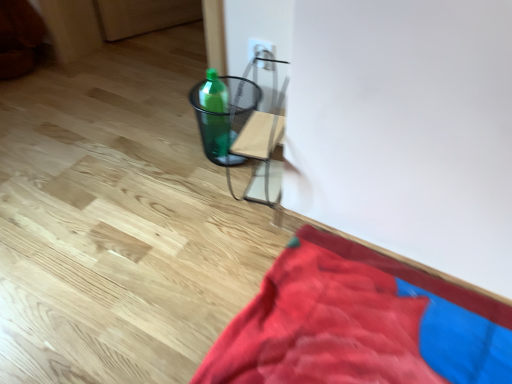
Question: Does white plastic electric outlet at upper center have a larger size compared to green plastic bottle at center?

Choices:
 (A) no
 (B) yes

Answer: (A)

Question: Considering the relative sizes of white plastic electric outlet at upper center and green plastic bottle at center in the image provided, is white plastic electric outlet at upper center smaller than green plastic bottle at center?

Choices:
 (A) yes
 (B) no

Answer: (A)

Question: Would you say green plastic bottle at center is part of white plastic electric outlet at upper center's contents?

Choices:
 (A) no
 (B) yes

Answer: (A)

Question: Is the surface of white plastic electric outlet at upper center in direct contact with green plastic bottle at center?

Choices:
 (A) no
 (B) yes

Answer: (A)

Question: Considering the relative sizes of white plastic electric outlet at upper center and green plastic bottle at center in the image provided, is white plastic electric outlet at upper center shorter than green plastic bottle at center?

Choices:
 (A) no
 (B) yes

Answer: (B)

Question: From a real-world perspective, is green plastic bottle at center positioned above or below velvet red blanket at lower right?

Choices:
 (A) below
 (B) above

Answer: (B)

Question: Based on their sizes in the image, would you say green plastic bottle at center is bigger or smaller than velvet red blanket at lower right?

Choices:
 (A) small
 (B) big

Answer: (A)

Question: Visually, is green plastic bottle at center positioned to the left or to the right of velvet red blanket at lower right?

Choices:
 (A) left
 (B) right

Answer: (A)

Question: From their relative heights in the image, would you say green plastic bottle at center is taller or shorter than velvet red blanket at lower right?

Choices:
 (A) tall
 (B) short

Answer: (A)

Question: Is white plastic electric outlet at upper center taller or shorter than green plastic bottle at center?

Choices:
 (A) tall
 (B) short

Answer: (B)

Question: From the image's perspective, is white plastic electric outlet at upper center positioned above or below green plastic bottle at center?

Choices:
 (A) below
 (B) above

Answer: (B)

Question: In the image, is white plastic electric outlet at upper center positioned in front of or behind green plastic bottle at center?

Choices:
 (A) front
 (B) behind

Answer: (B)

Question: Is white plastic electric outlet at upper center bigger or smaller than green plastic bottle at center?

Choices:
 (A) small
 (B) big

Answer: (A)

Question: Relative to green plastic bottle at center, is velvet red blanket at lower right in front or behind?

Choices:
 (A) behind
 (B) front

Answer: (B)

Question: Considering the relative positions of velvet red blanket at lower right and green plastic bottle at center in the image provided, is velvet red blanket at lower right to the left or to the right of green plastic bottle at center?

Choices:
 (A) left
 (B) right

Answer: (B)